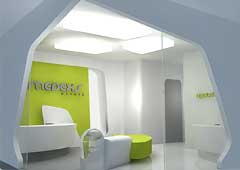
This screenshot has height=170, width=240. Identify the location of another blurry logo on wall. (203, 96).